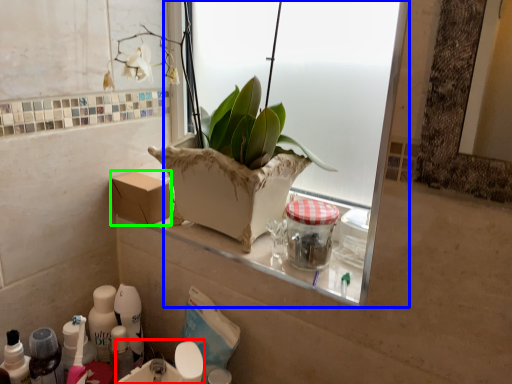
Question: Which is nearer to the sink (highlighted by a red box)? window (highlighted by a blue box) or cardboard box (highlighted by a green box).

Choices:
 (A) window
 (B) cardboard box

Answer: (B)